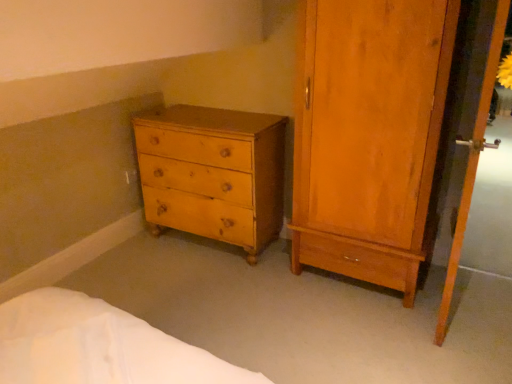
Question: From a real-world perspective, is light brown wood chest of drawers at lower left beneath wooden screen door at right?

Choices:
 (A) yes
 (B) no

Answer: (A)

Question: Is light brown wood chest of drawers at lower left oriented towards wooden screen door at right?

Choices:
 (A) yes
 (B) no

Answer: (B)

Question: Is light brown wood chest of drawers at lower left next to wooden screen door at right?

Choices:
 (A) no
 (B) yes

Answer: (A)

Question: Can you confirm if light brown wood chest of drawers at lower left is positioned to the right of wooden screen door at right?

Choices:
 (A) no
 (B) yes

Answer: (A)

Question: Can you confirm if light brown wood chest of drawers at lower left is smaller than wooden screen door at right?

Choices:
 (A) yes
 (B) no

Answer: (B)

Question: Is light brown wood chest of drawers at lower left taller than wooden screen door at right?

Choices:
 (A) no
 (B) yes

Answer: (A)

Question: From a real-world perspective, is light brown wood chest of drawers at lower left beneath matte wood wardrobe at right?

Choices:
 (A) yes
 (B) no

Answer: (A)

Question: Does light brown wood chest of drawers at lower left appear on the right side of matte wood wardrobe at right?

Choices:
 (A) yes
 (B) no

Answer: (B)

Question: Considering the relative positions of light brown wood chest of drawers at lower left and matte wood wardrobe at right in the image provided, is light brown wood chest of drawers at lower left to the left of matte wood wardrobe at right from the viewer's perspective?

Choices:
 (A) no
 (B) yes

Answer: (B)

Question: Considering the relative sizes of light brown wood chest of drawers at lower left and matte wood wardrobe at right in the image provided, is light brown wood chest of drawers at lower left thinner than matte wood wardrobe at right?

Choices:
 (A) yes
 (B) no

Answer: (A)

Question: Is light brown wood chest of drawers at lower left far away from matte wood wardrobe at right?

Choices:
 (A) no
 (B) yes

Answer: (A)

Question: Is light brown wood chest of drawers at lower left oriented away from matte wood wardrobe at right?

Choices:
 (A) yes
 (B) no

Answer: (B)

Question: Is wooden screen door at right looking in the opposite direction of matte wood wardrobe at right?

Choices:
 (A) yes
 (B) no

Answer: (A)